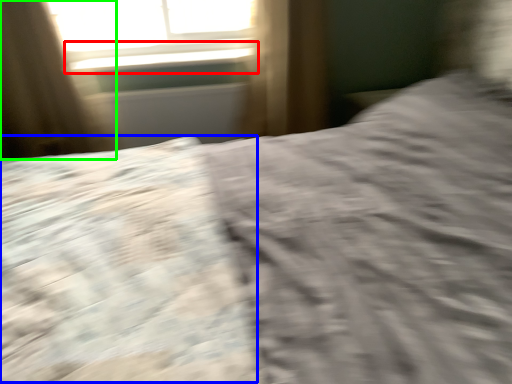
Question: Based on their relative distances, which object is farther from window sill (highlighted by a red box)? Choose from sheet (highlighted by a blue box) and curtain (highlighted by a green box).

Choices:
 (A) sheet
 (B) curtain

Answer: (A)